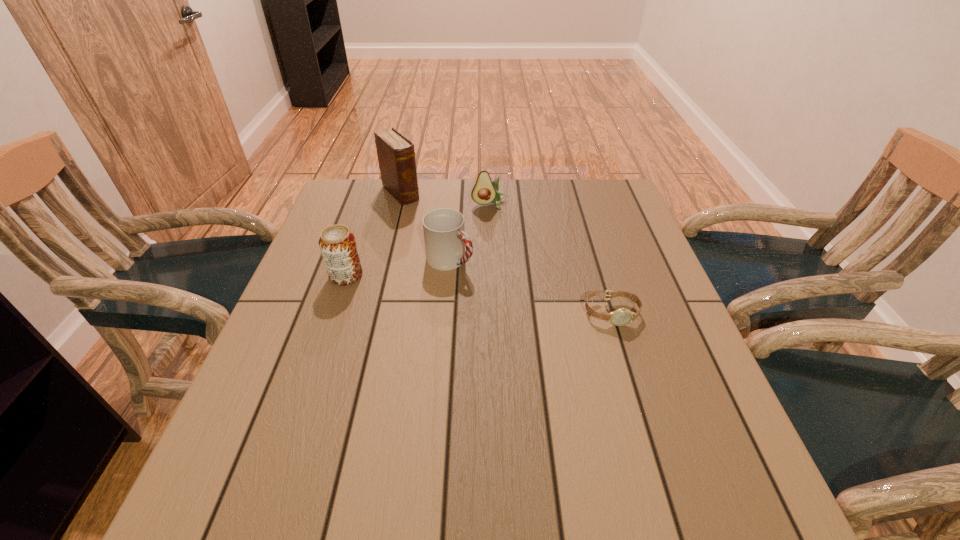
Identify the location of unoccupied area between the avocado and the cup. This screenshot has height=540, width=960. (470, 232).

The width and height of the screenshot is (960, 540). In order to click on unoccupied position between the cup and the avocado in this screenshot , I will do `click(470, 232)`.

The image size is (960, 540). I want to click on blank region between the cup and the beer can, so click(398, 268).

The width and height of the screenshot is (960, 540). In order to click on free space that is in between the cup and the beer can in this screenshot , I will do `click(398, 268)`.

What are the coordinates of `vacant area that lies between the beer can and the nearest object` in the screenshot? It's located at (479, 294).

Locate an element on the screen. The width and height of the screenshot is (960, 540). empty space that is in between the diary and the avocado is located at coordinates (445, 199).

Identify which object is the nearest to the cup. Please provide its 2D coordinates. Your answer should be formatted as a tuple, i.e. [(x, y)], where the tuple contains the x and y coordinates of a point satisfying the conditions above.

[(337, 243)]

Locate an element on the screen. Image resolution: width=960 pixels, height=540 pixels. object that ranks as the second closest to the rightmost object is located at coordinates (484, 191).

I want to click on vacant space that satisfies the following two spatial constraints: 1. on the back side of the beer can; 2. on the left side of the tallest object, so click(x=374, y=193).

Where is `free region that satisfies the following two spatial constraints: 1. on the back side of the beer can; 2. on the right side of the cup`? Image resolution: width=960 pixels, height=540 pixels. free region that satisfies the following two spatial constraints: 1. on the back side of the beer can; 2. on the right side of the cup is located at coordinates [351, 260].